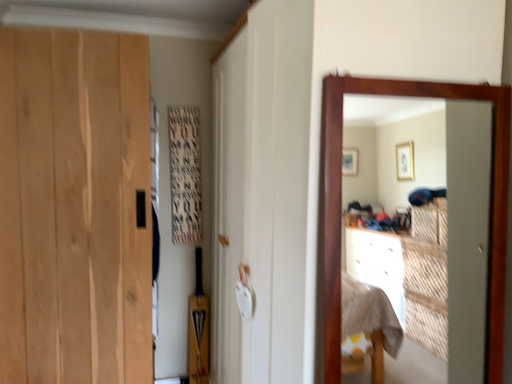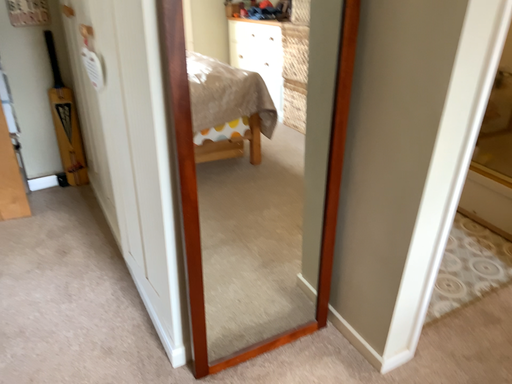
Question: Which way did the camera rotate in the video?

Choices:
 (A) rotated downward
 (B) rotated upward

Answer: (A)